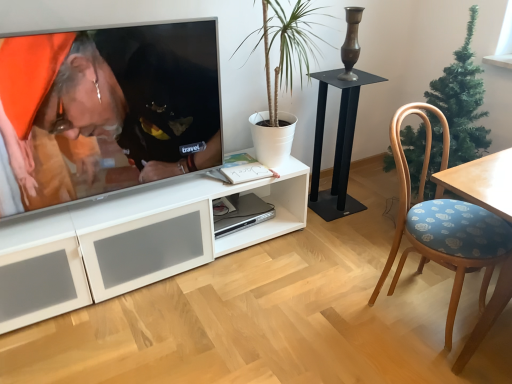
Where is `vacant space in front of wooden chair with blue floral cushion at right`? The height and width of the screenshot is (384, 512). vacant space in front of wooden chair with blue floral cushion at right is located at coordinates (435, 362).